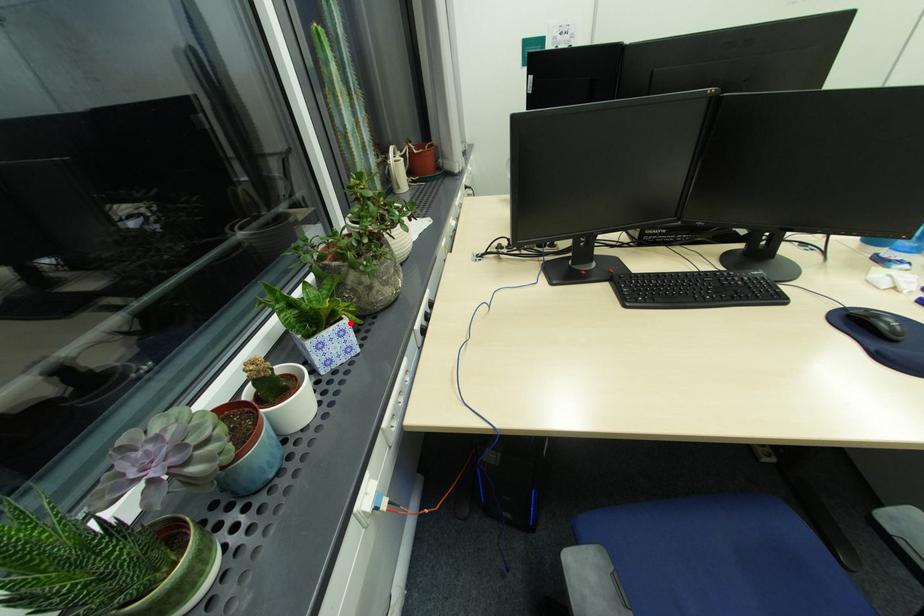
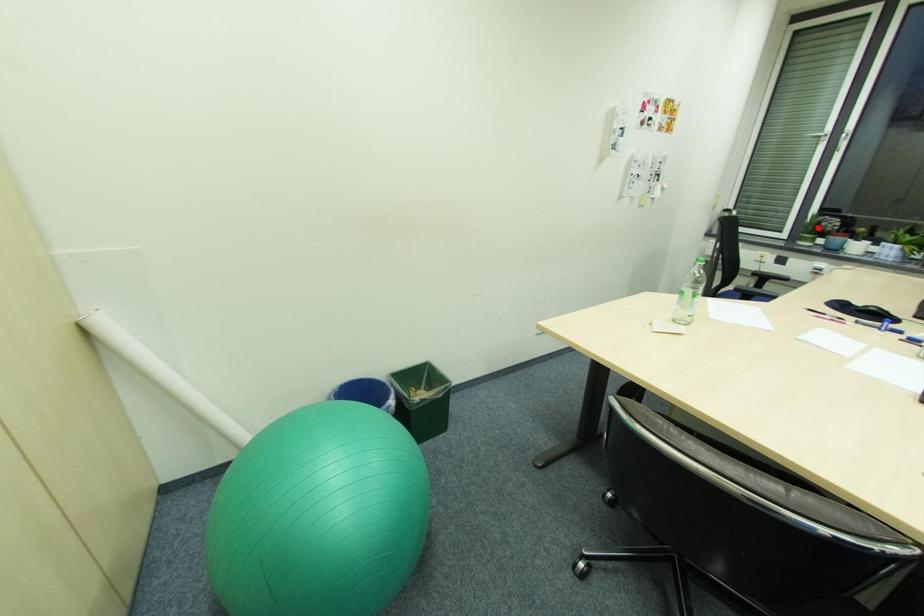
I am providing you with two images of the same scene from different viewpoints. A red point is marked on the first image and another point is marked on the second image. Is the red point in image1 aligned with the point shown in image2?

No